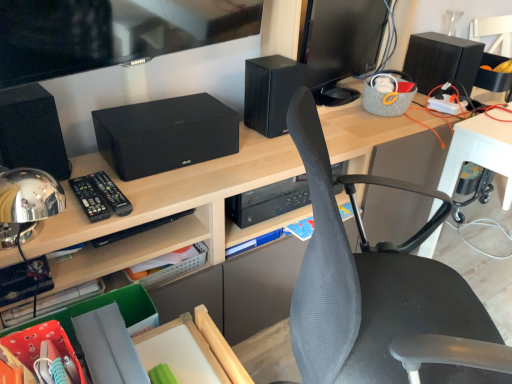
Question: Looking at their shapes, would you say black plastic remote at center, which appears as the second control when viewed from the left, is wider or thinner than gray mesh chair at center?

Choices:
 (A) wide
 (B) thin

Answer: (B)

Question: Does point (99, 180) appear closer or farther from the camera than point (443, 354)?

Choices:
 (A) farther
 (B) closer

Answer: (A)

Question: Which of these objects is positioned farthest from the black matte speaker at center?

Choices:
 (A) black plastic remote at left, which appears as the 1th control when viewed from the left
 (B) gray mesh chair at center
 (C) black matte speaker at center, positioned as the 2th speaker in back-to-front order
 (D) black glossy monitor at upper right
 (E) black matte speaker at upper left, which appears as the first speaker when viewed from the left

Answer: (B)

Question: Estimate the real-world distances between objects in this image. Which object is closer to the black matte speaker at center?

Choices:
 (A) black matte speaker at upper right, the third speaker from the left
 (B) gray mesh chair at center
 (C) black plastic remote at center, positioned as the first control in right-to-left order
 (D) black plastic remote at left, the second control positioned from the right
 (E) black matte speaker at center, which ranks as the 2th speaker in front-to-back order

Answer: (C)